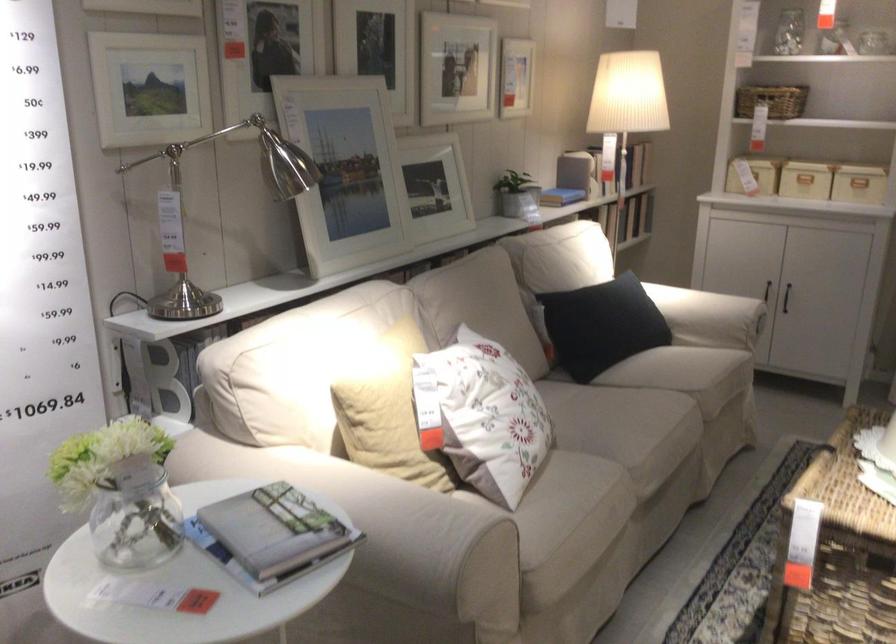
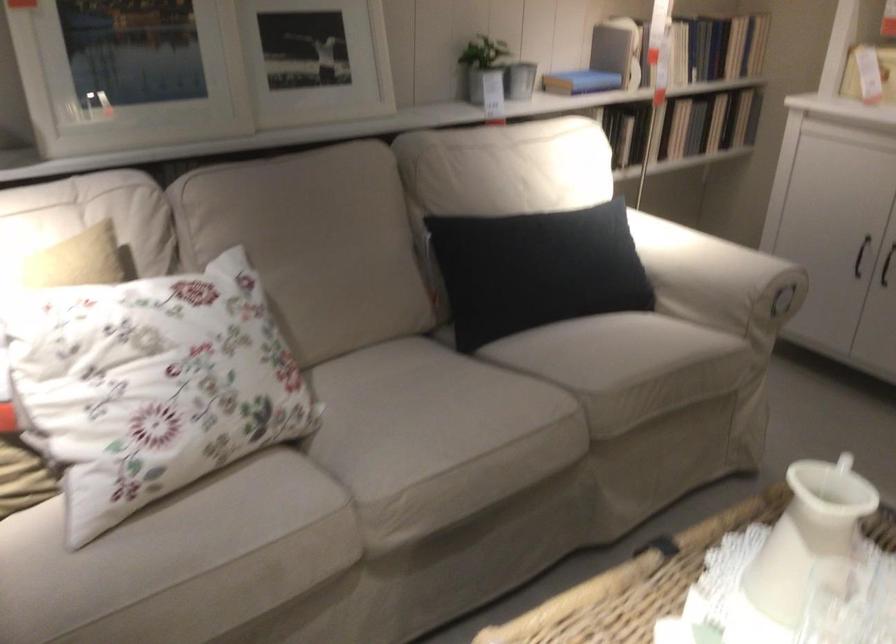
The point at (565, 187) is marked in the first image. Where is the corresponding point in the second image?

(580, 82)